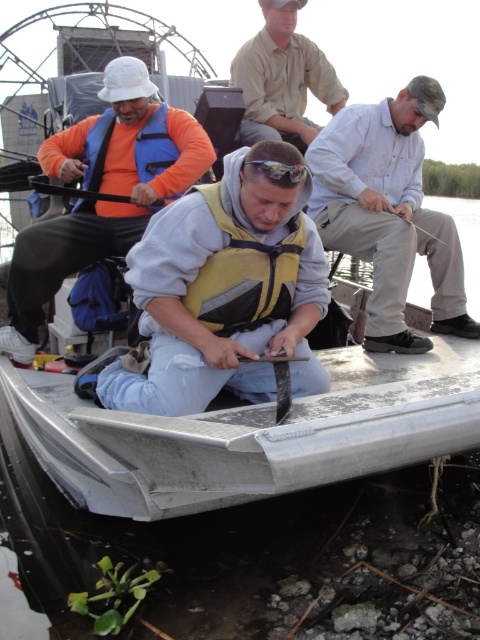
Identify the location of silver metallic boat at center. Image resolution: width=480 pixels, height=640 pixels. (251, 435).

Who is higher up, silver metallic boat at center or orange life vest at upper left?

orange life vest at upper left is above.

Measure the distance between silver metallic boat at center and camera.

silver metallic boat at center and camera are 5.73 feet apart.

You are a GUI agent. You are given a task and a screenshot of the screen. Output one action in this format:
    pyautogui.click(x=<x>, y=<y>)
    Task: Click on the silver metallic boat at center
    
    Given the screenshot: What is the action you would take?
    pyautogui.click(x=251, y=435)

Is light blue shirt at center closer to the viewer compared to orange life vest at upper left?

No, light blue shirt at center is behind orange life vest at upper left.

Is point (376, 250) behind point (12, 298)?

That is False.

This screenshot has height=640, width=480. I want to click on light blue shirt at center, so click(388, 212).

Who is more forward, (38,240) or (296,141)?

Point (38,240) is in front.

Who is lower down, orange life vest at upper left or khaki cotton shirt at upper center?

orange life vest at upper left

This screenshot has height=640, width=480. What do you see at coordinates (103, 189) in the screenshot?
I see `orange life vest at upper left` at bounding box center [103, 189].

In order to click on orange life vest at upper left in this screenshot , I will do `click(103, 189)`.